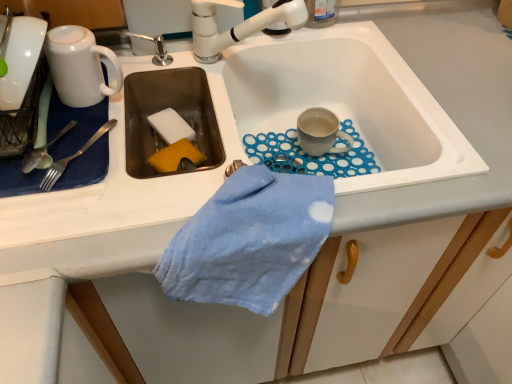
Where is `free space to the back side of white glossy mug at upper left, which is counted as the 2th coffee cup, starting from the right`? This screenshot has width=512, height=384. free space to the back side of white glossy mug at upper left, which is counted as the 2th coffee cup, starting from the right is located at coordinates (150, 58).